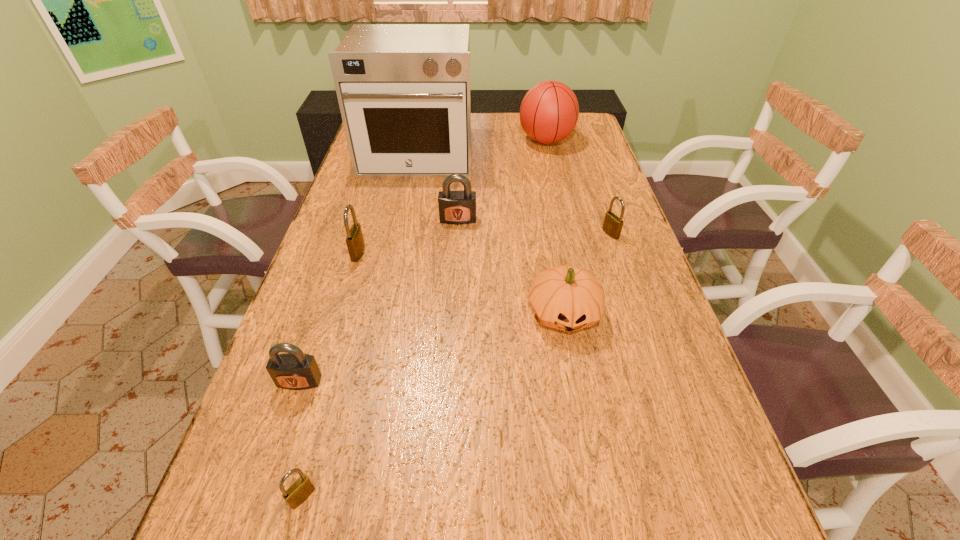
Locate an element on the screen. The height and width of the screenshot is (540, 960). vacant space at the left edge of the desktop is located at coordinates (339, 239).

This screenshot has height=540, width=960. In the image, there is a desktop. Find the location of `vacant region at the right edge`. vacant region at the right edge is located at coordinates (648, 321).

Locate an element on the screen. This screenshot has width=960, height=540. empty space between the tallest object and the basketball is located at coordinates (482, 147).

Locate an element on the screen. This screenshot has width=960, height=540. free space between the sixth farthest object and the toaster oven is located at coordinates (491, 234).

Where is `free space between the toaster oven and the nearest padlock`? free space between the toaster oven and the nearest padlock is located at coordinates (360, 326).

Find the location of a particular element. This screenshot has width=960, height=540. free space between the tallest object and the second padlock from right to left is located at coordinates (438, 187).

This screenshot has height=540, width=960. In order to click on blank region between the orange gourd and the bigger gray padlock in this screenshot , I will do `click(511, 266)`.

Find the location of a particular element. unoccupied area between the gourd and the farthest padlock is located at coordinates pyautogui.click(x=511, y=266).

Image resolution: width=960 pixels, height=540 pixels. In order to click on vacant space in between the tallest object and the right gray padlock in this screenshot , I will do `click(438, 187)`.

The width and height of the screenshot is (960, 540). In order to click on empty location between the seventh farthest object and the gourd in this screenshot , I will do `click(431, 347)`.